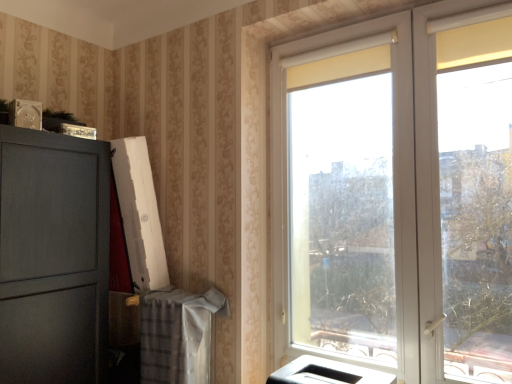
Question: From the image's perspective, would you say white plastic window at right is positioned over white glossy printer at lower center?

Choices:
 (A) yes
 (B) no

Answer: (A)

Question: Is white plastic window at right beside white glossy printer at lower center?

Choices:
 (A) yes
 (B) no

Answer: (B)

Question: Is white plastic window at right shorter than white glossy printer at lower center?

Choices:
 (A) yes
 (B) no

Answer: (B)

Question: Could you tell me if white plastic window at right is turned towards white glossy printer at lower center?

Choices:
 (A) yes
 (B) no

Answer: (A)

Question: Could white glossy printer at lower center be considered to be inside white plastic window at right?

Choices:
 (A) no
 (B) yes

Answer: (A)

Question: Can you confirm if white plastic window at right is positioned to the left of white glossy printer at lower center?

Choices:
 (A) no
 (B) yes

Answer: (A)

Question: Considering the relative sizes of white glossy printer at lower center and white plastic window at right in the image provided, is white glossy printer at lower center wider than white plastic window at right?

Choices:
 (A) no
 (B) yes

Answer: (A)

Question: Is white plastic window at right completely or partially inside white glossy printer at lower center?

Choices:
 (A) no
 (B) yes

Answer: (A)

Question: Is white glossy printer at lower center to the right of white plastic window at right from the viewer's perspective?

Choices:
 (A) no
 (B) yes

Answer: (A)

Question: Is white glossy printer at lower center thinner than white plastic window at right?

Choices:
 (A) yes
 (B) no

Answer: (A)

Question: Is white glossy printer at lower center positioned beyond the bounds of white plastic window at right?

Choices:
 (A) no
 (B) yes

Answer: (B)

Question: Is white glossy printer at lower center at the left side of white plastic window at right?

Choices:
 (A) yes
 (B) no

Answer: (A)

Question: From the image's perspective, is white glossy printer at lower center positioned above or below white plastic window at right?

Choices:
 (A) below
 (B) above

Answer: (A)